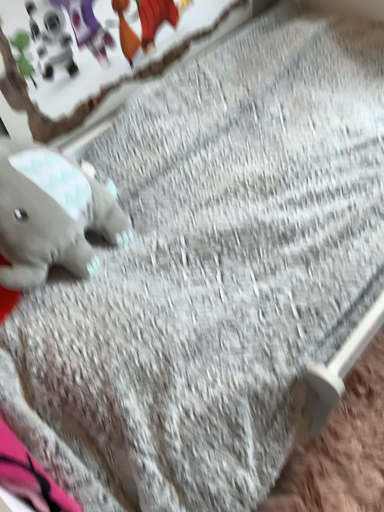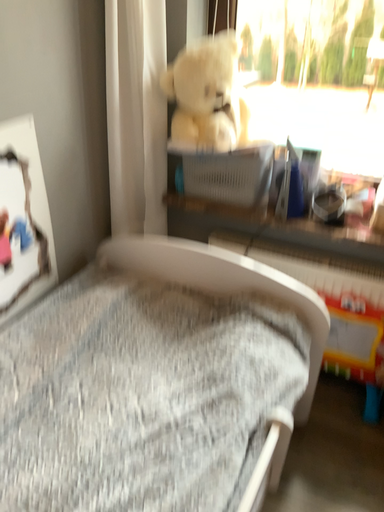
Question: How did the camera likely rotate when shooting the video?

Choices:
 (A) rotated right
 (B) rotated left

Answer: (A)